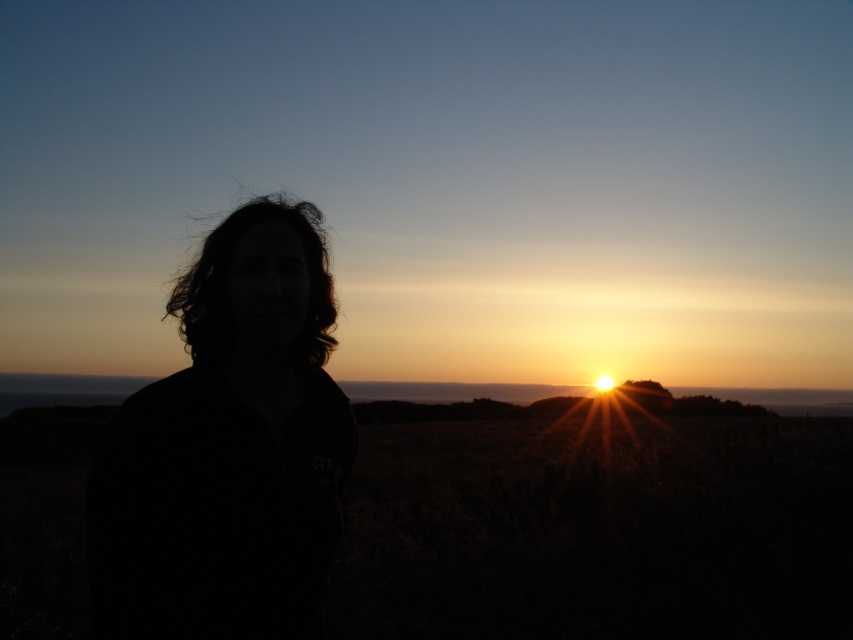
Can you confirm if black matte hair at left is thinner than dark curly hair at center?

Correct, black matte hair at left's width is less than dark curly hair at center's.

Does black matte hair at left have a smaller size compared to dark curly hair at center?

Indeed, black matte hair at left has a smaller size compared to dark curly hair at center.

This screenshot has height=640, width=853. What do you see at coordinates (228, 449) in the screenshot? I see `black matte hair at left` at bounding box center [228, 449].

The height and width of the screenshot is (640, 853). I want to click on black matte hair at left, so click(x=228, y=449).